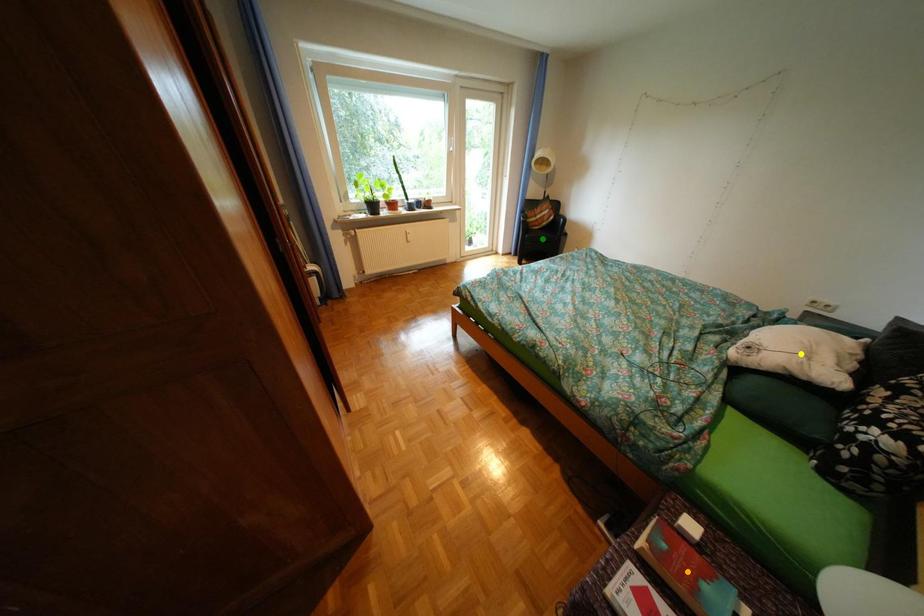
Order these from nearest to farthest:
1. yellow point
2. orange point
3. green point

orange point → yellow point → green point